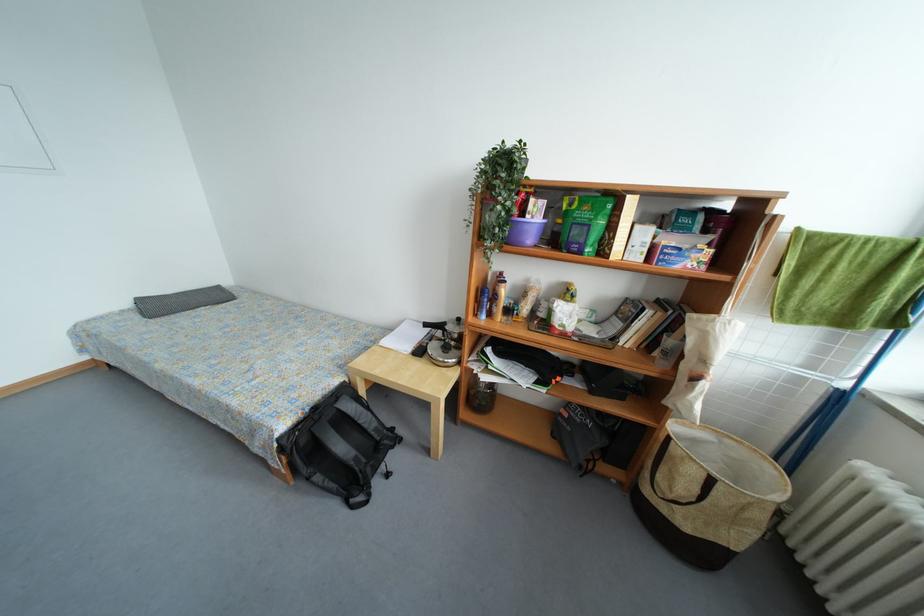
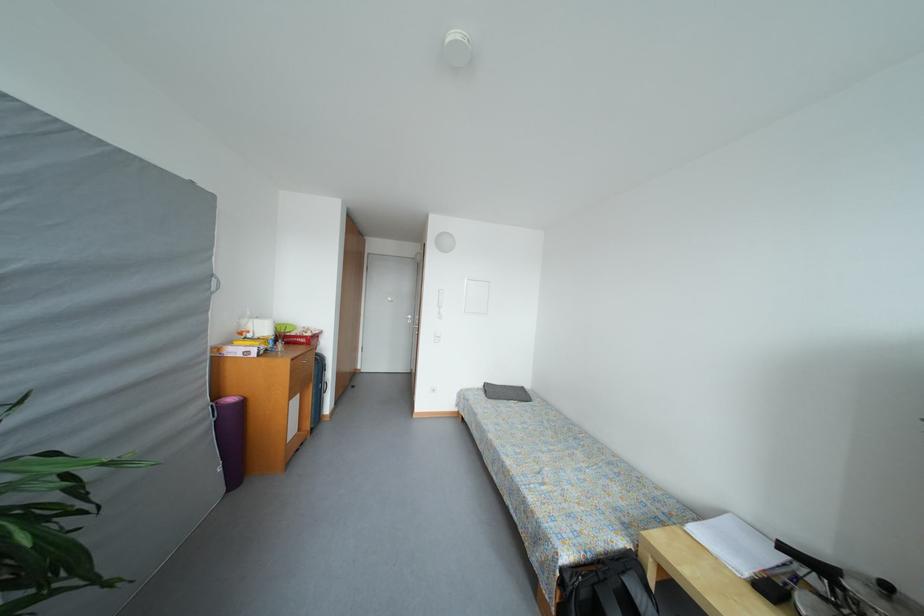
The point at (x=166, y=370) is marked in the first image. Where is the corresponding point in the second image?

(496, 440)